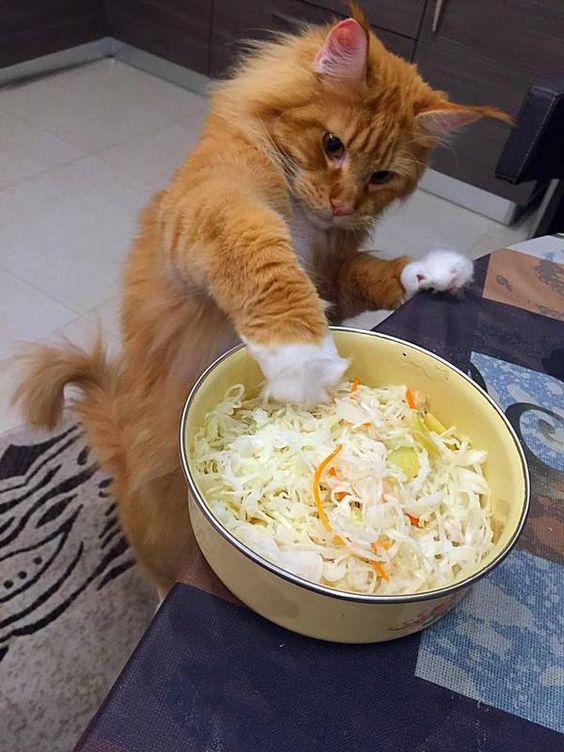
This screenshot has height=752, width=564. I want to click on dark blue table, so click(227, 638).